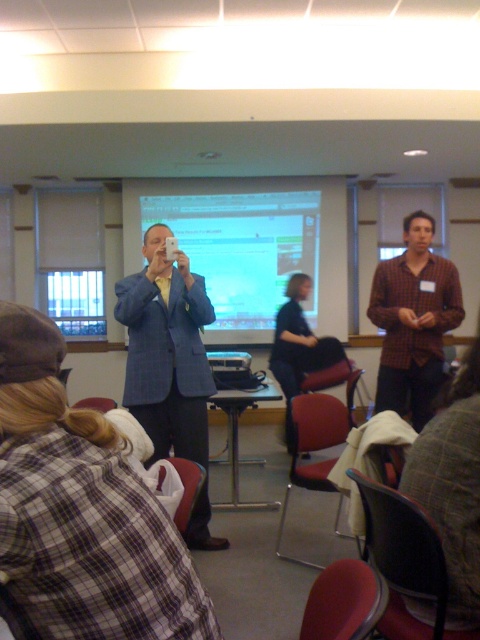
Question: Does plaid shirt at center have a lesser width compared to black plastic projector at center?

Choices:
 (A) no
 (B) yes

Answer: (A)

Question: Which object is positioned closest to the matte white projector screen at center?

Choices:
 (A) black plastic projector at center
 (B) plaid shirt at center
 (C) blue textured blazer at center

Answer: (A)

Question: Is plaid shirt at center to the right of black plastic projector at center from the viewer's perspective?

Choices:
 (A) no
 (B) yes

Answer: (B)

Question: Among these points, which one is farthest from the camera?

Choices:
 (A) (411, 221)
 (B) (151, 209)
 (C) (171, 433)
 (D) (249, 355)

Answer: (B)

Question: In this image, where is matte white projector screen at center located relative to plaid shirt at center?

Choices:
 (A) below
 (B) above

Answer: (B)

Question: Based on their relative distances, which object is farther from the matte white projector screen at center?

Choices:
 (A) blue textured blazer at center
 (B) black plastic projector at center

Answer: (A)